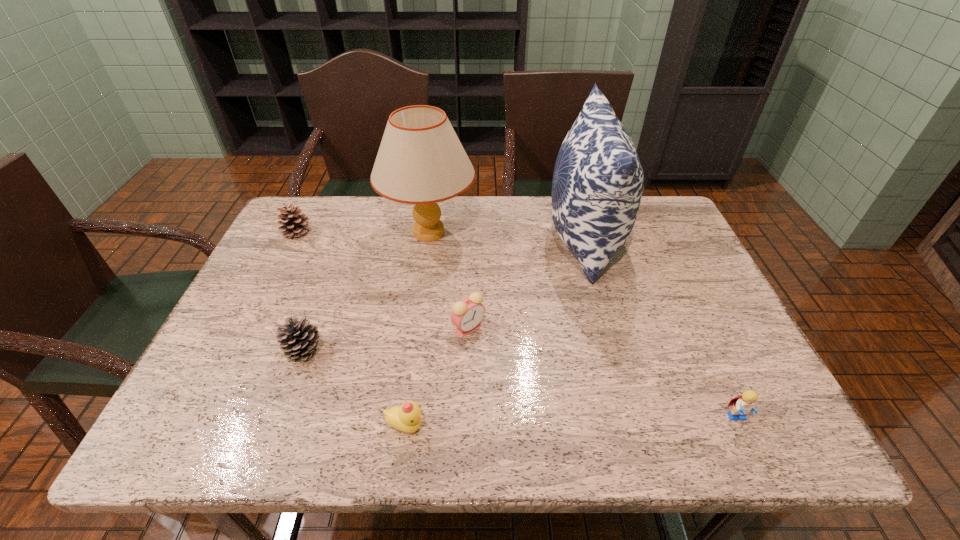
In order to click on duckling at the near edge in this screenshot , I will do `click(407, 418)`.

Where is `Lego present at the near edge`? Lego present at the near edge is located at coordinates (743, 404).

The width and height of the screenshot is (960, 540). I want to click on object situated at the right edge, so 743,404.

Locate an element on the screen. object that is at the far left corner is located at coordinates (294, 222).

Identify the location of object present at the near right corner. This screenshot has height=540, width=960. (743, 404).

In order to click on free location at the far edge of the desktop in this screenshot , I will do [x=445, y=224].

Where is `free space at the near edge of the desktop`? The height and width of the screenshot is (540, 960). free space at the near edge of the desktop is located at coordinates (285, 440).

I want to click on vacant area at the left edge of the desktop, so click(230, 390).

Where is `vacant region at the right edge of the desktop`? This screenshot has height=540, width=960. vacant region at the right edge of the desktop is located at coordinates (690, 330).

Where is `free region at the near right corner of the desktop`? The width and height of the screenshot is (960, 540). free region at the near right corner of the desktop is located at coordinates (700, 410).